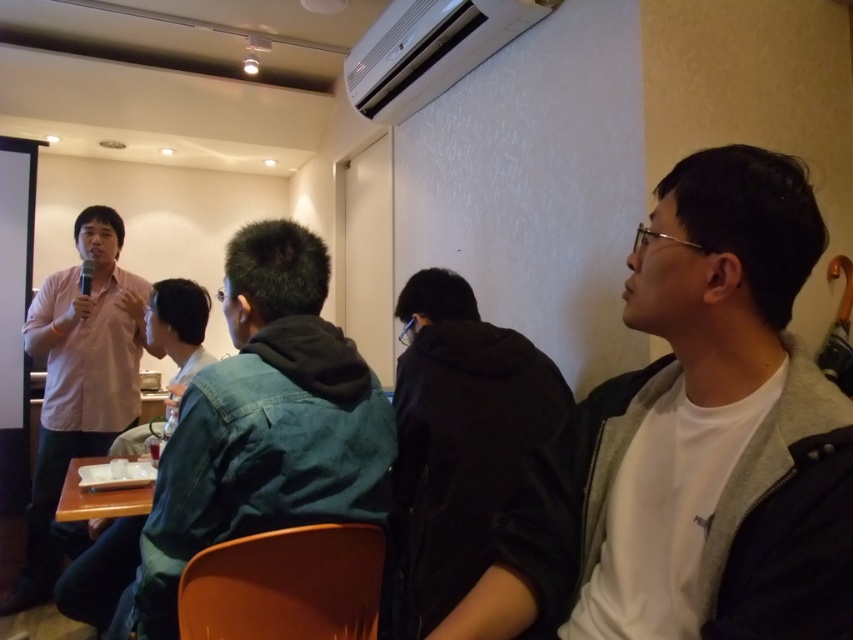
Question: Among these points, which one is farthest from the camera?

Choices:
 (A) (524, 3)
 (B) (70, 522)
 (C) (142, 506)
 (D) (399, 470)

Answer: (B)

Question: Observing the image, what is the correct spatial positioning of black matte jacket at center in reference to yellow wood tray at lower left?

Choices:
 (A) below
 (B) above

Answer: (B)

Question: Which point is farther to the camera?

Choices:
 (A) (128, 512)
 (B) (523, 28)

Answer: (B)

Question: Can you confirm if white matte jacket at center is wider than yellow wood tray at lower left?

Choices:
 (A) no
 (B) yes

Answer: (A)

Question: Among these points, which one is nearest to the camera?

Choices:
 (A) (143, 291)
 (B) (144, 525)

Answer: (B)

Question: Is white matte jacket at center wider than yellow wood tray at lower left?

Choices:
 (A) yes
 (B) no

Answer: (B)